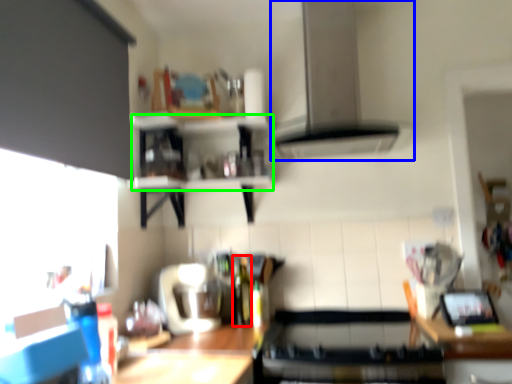
Question: Which object is positioned farthest from bottle (highlighted by a red box)? Select from exhaust hood (highlighted by a blue box) and shelf (highlighted by a green box).

Choices:
 (A) exhaust hood
 (B) shelf

Answer: (A)